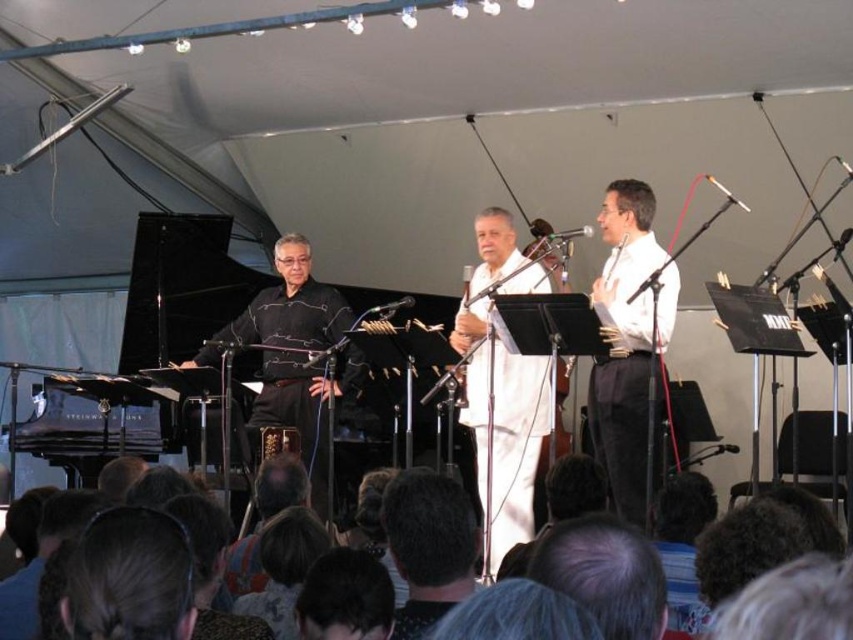
Is point (216, 355) positioned after point (393, 538)?

Yes, point (216, 355) is behind point (393, 538).

Between point (329, 330) and point (438, 579), which one is positioned in front?

Point (438, 579) is more forward.

Who is more forward, (294, 282) or (399, 564)?

Point (399, 564)

At what (x,y) coordinates should I click in order to perform the action: click on black matte shirt at center. Please return your answer as a coordinate pair (x, y). The image size is (853, 640). Looking at the image, I should click on (291, 305).

Between point (616, 472) and point (299, 296), which one is positioned behind?

The point (299, 296) is behind.

Where is `white glossy shirt at center`? Image resolution: width=853 pixels, height=640 pixels. white glossy shirt at center is located at coordinates (630, 346).

Where is `white glossy shirt at center`? The width and height of the screenshot is (853, 640). white glossy shirt at center is located at coordinates (630, 346).

Is point (525, 268) positioned after point (442, 538)?

Yes, point (525, 268) is farther from viewer.

Between white cotton conductor at center and dark brown hair at center, which one appears on the right side from the viewer's perspective?

Positioned to the right is white cotton conductor at center.

This screenshot has height=640, width=853. What do you see at coordinates (506, 438) in the screenshot?
I see `white cotton conductor at center` at bounding box center [506, 438].

Image resolution: width=853 pixels, height=640 pixels. I want to click on white cotton conductor at center, so click(x=506, y=438).